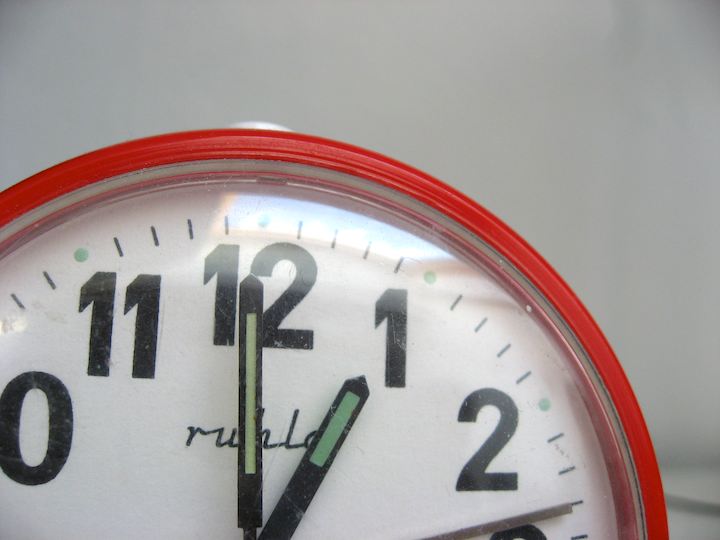
Locate an element on the screen. red clock is located at coordinates (497, 238).